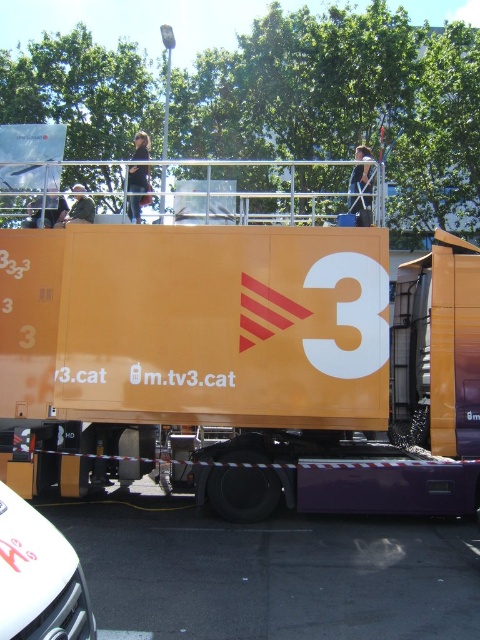
Is orange matte truck at center thinner than white glossy car at lower left?

No, orange matte truck at center is not thinner than white glossy car at lower left.

This screenshot has height=640, width=480. What do you see at coordinates (242, 364) in the screenshot?
I see `orange matte truck at center` at bounding box center [242, 364].

Locate an element on the screen. The height and width of the screenshot is (640, 480). orange matte truck at center is located at coordinates (242, 364).